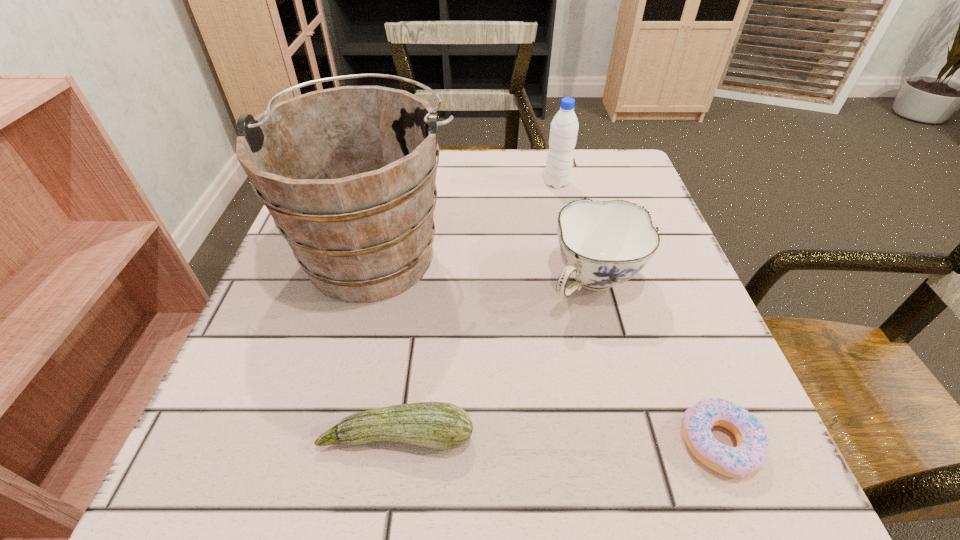
Where is `vacant space that satisfies the following two spatial constraints: 1. on the handle side of the water bottle; 2. on the left side of the bucket`? The height and width of the screenshot is (540, 960). vacant space that satisfies the following two spatial constraints: 1. on the handle side of the water bottle; 2. on the left side of the bucket is located at coordinates (393, 183).